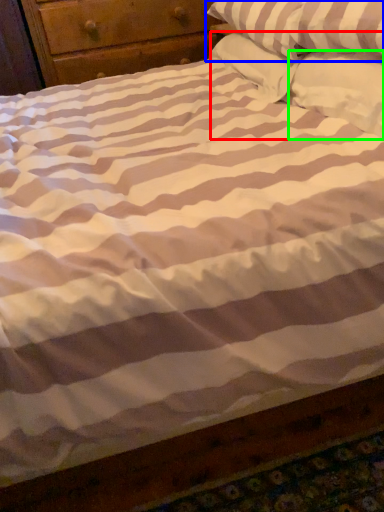
Question: Which object is the closest to the pillow (highlighted by a red box)? Choose among these: pillow (highlighted by a blue box) or pillow (highlighted by a green box).

Choices:
 (A) pillow
 (B) pillow

Answer: (B)